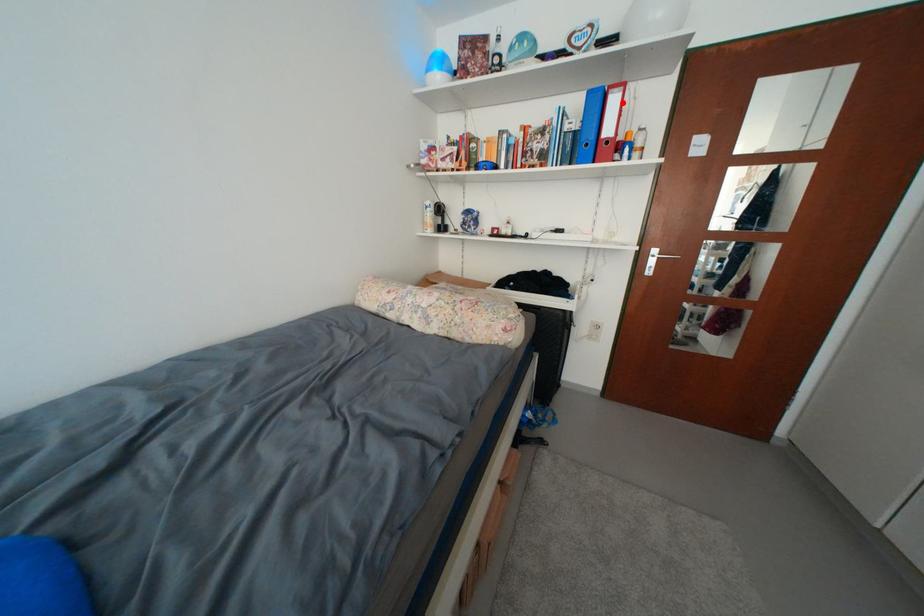
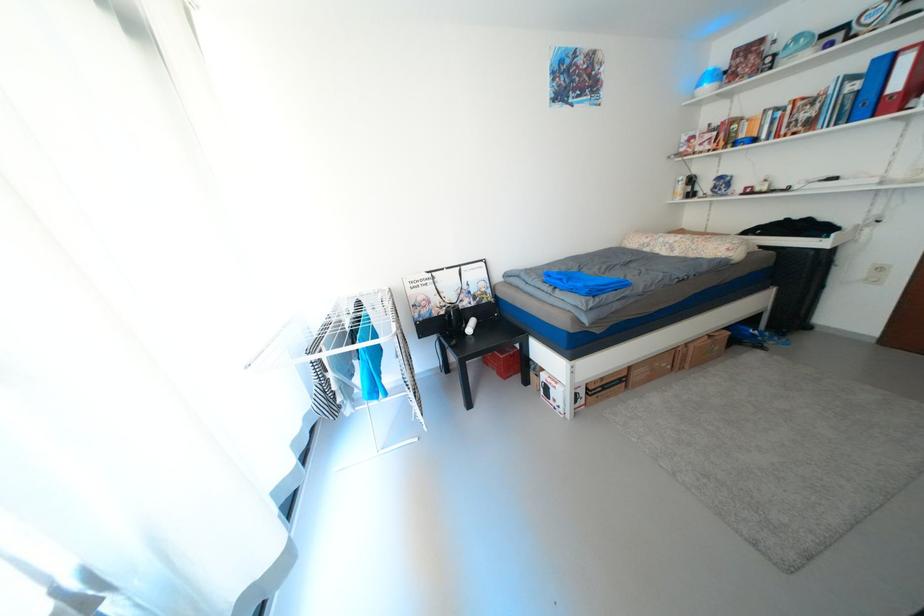
In the second image, find the point that corresponds to the highlighted location in the first image.

(916, 62)